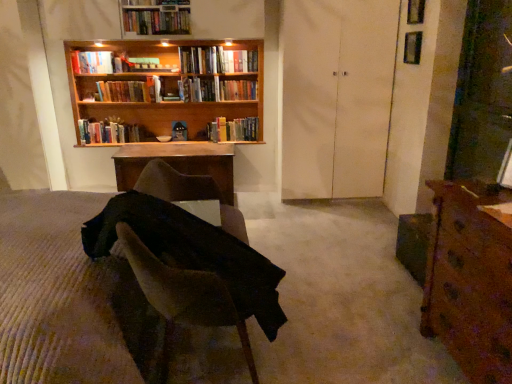
Question: In which direction should I rotate to look at hardcover books at center, which ranks as the 5th book in bottom-to-top order?

Choices:
 (A) left
 (B) right

Answer: (A)

Question: Which direction should I rotate to look at hardcover books at center, acting as the 7th book starting from the top, — up or down?

Choices:
 (A) up
 (B) down

Answer: (A)

Question: Is hardcover book at upper center, which ranks as the sixth book in bottom-to-top order, closer to camera compared to transparent glass window at upper right, positioned as the first window in top-to-bottom order?

Choices:
 (A) yes
 (B) no

Answer: (B)

Question: From the image's perspective, is hardcover book at upper center, placed as the second book when sorted from top to bottom, on transparent glass window at upper right, positioned as the first window in top-to-bottom order?

Choices:
 (A) no
 (B) yes

Answer: (A)

Question: Is hardcover book at upper center, which ranks as the sixth book in bottom-to-top order, to the right of transparent glass window at upper right, positioned as the first window in top-to-bottom order, from the viewer's perspective?

Choices:
 (A) yes
 (B) no

Answer: (B)

Question: Can you confirm if hardcover book at upper center, placed as the second book when sorted from top to bottom, is taller than transparent glass window at upper right, which appears as the second window when ordered from the bottom?

Choices:
 (A) yes
 (B) no

Answer: (B)

Question: Does hardcover book at upper center, placed as the second book when sorted from top to bottom, have a larger size compared to transparent glass window at upper right, positioned as the first window in top-to-bottom order?

Choices:
 (A) yes
 (B) no

Answer: (A)

Question: Can you confirm if hardcover book at upper center, placed as the second book when sorted from top to bottom, is wider than transparent glass window at upper right, positioned as the first window in top-to-bottom order?

Choices:
 (A) yes
 (B) no

Answer: (A)

Question: Is white matte door at center located within transparent glass window at upper right, positioned as the first window in top-to-bottom order?

Choices:
 (A) no
 (B) yes

Answer: (A)

Question: From a real-world perspective, is transparent glass window at upper right, positioned as the first window in top-to-bottom order, positioned over white matte door at center based on gravity?

Choices:
 (A) yes
 (B) no

Answer: (A)

Question: Is transparent glass window at upper right, positioned as the first window in top-to-bottom order, looking in the opposite direction of white matte door at center?

Choices:
 (A) no
 (B) yes

Answer: (A)

Question: Would you say transparent glass window at upper right, which appears as the second window when ordered from the bottom, is outside white matte door at center?

Choices:
 (A) no
 (B) yes

Answer: (B)

Question: Is transparent glass window at upper right, positioned as the first window in top-to-bottom order, to the right of white matte door at center from the viewer's perspective?

Choices:
 (A) yes
 (B) no

Answer: (A)

Question: Is transparent glass window at upper right, which appears as the second window when ordered from the bottom, facing towards white matte door at center?

Choices:
 (A) yes
 (B) no

Answer: (B)

Question: From the image's perspective, does wooden bookshelf at upper center appear higher than brown fabric chair at center?

Choices:
 (A) yes
 (B) no

Answer: (A)